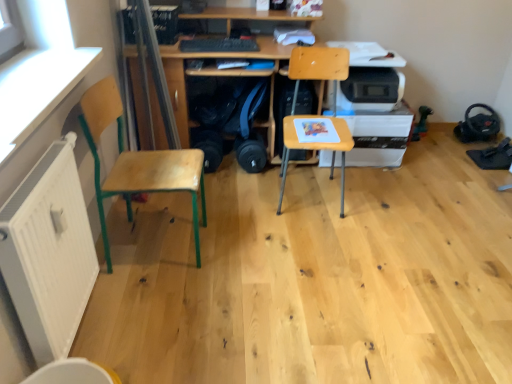
Identify the location of vacant space in white matte radiator at lower left (from a real-world perspective). The height and width of the screenshot is (384, 512). (89, 315).